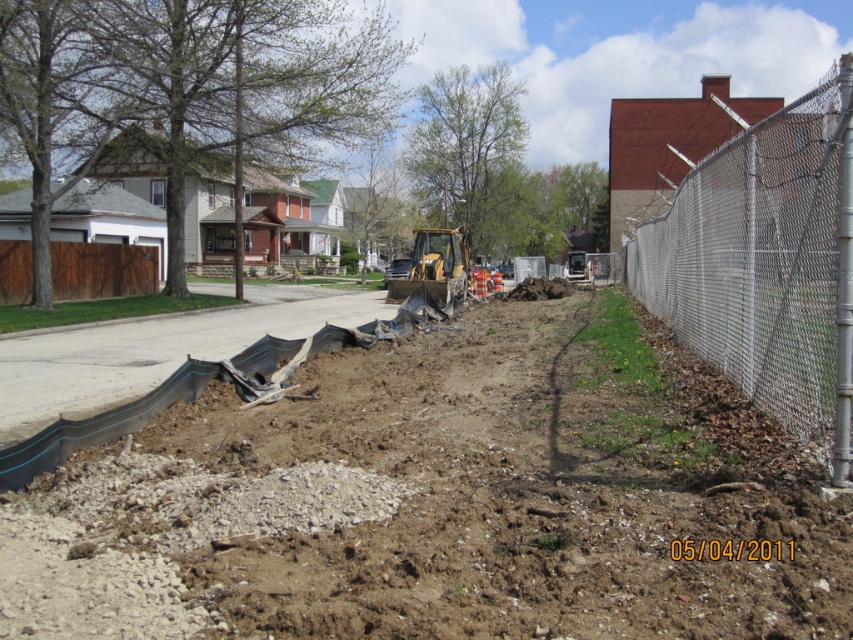
Is point (618, 561) farther from camera compared to point (422, 285)?

No, it is in front of (422, 285).

Can you confirm if brown soil at center is wider than yellow-green rubber excavator at center?

Yes, brown soil at center is wider than yellow-green rubber excavator at center.

Is point (71, 609) behind point (448, 301)?

No, it is in front of (448, 301).

Find the location of a particular element. The image size is (853, 640). brown soil at center is located at coordinates (445, 500).

Consider the image. Is white chain-link fence at right bigger than yellow-green rubber excavator at center?

Yes.

This screenshot has height=640, width=853. What do you see at coordinates (766, 264) in the screenshot?
I see `white chain-link fence at right` at bounding box center [766, 264].

At what (x,y) coordinates should I click in order to perform the action: click on white chain-link fence at right. Please return your answer as a coordinate pair (x, y). The image size is (853, 640). Looking at the image, I should click on (766, 264).

The image size is (853, 640). I want to click on white chain-link fence at right, so click(x=766, y=264).

Does brown soil at center have a lesser width compared to white chain-link fence at right?

No.

Can you confirm if brown soil at center is positioned below white chain-link fence at right?

Indeed, brown soil at center is positioned under white chain-link fence at right.

Between point (329, 445) and point (825, 346), which one is positioned in front?

Point (825, 346)

Where is `brown soil at center`? brown soil at center is located at coordinates (445, 500).